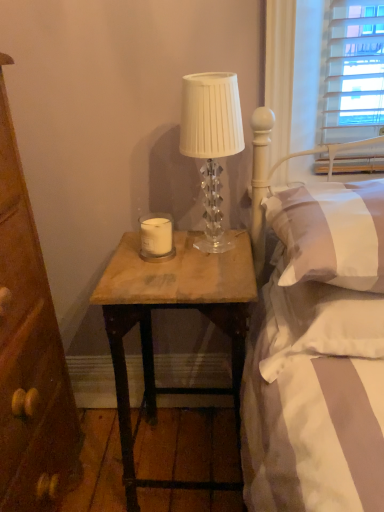
What are the coordinates of `empty space that is ontop of wooden table at center (from a real-world perspective)` in the screenshot? It's located at (181, 259).